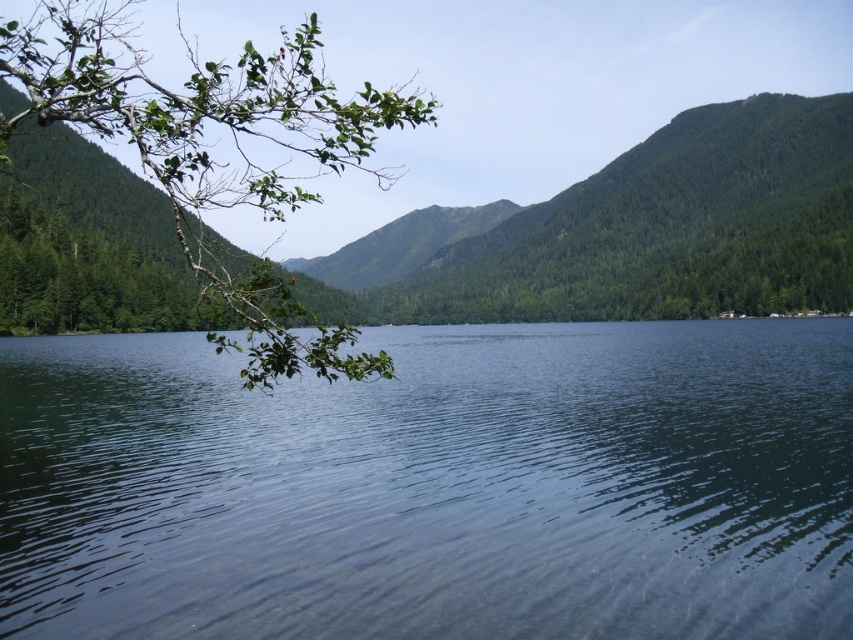
Question: In this image, where is clear water at center located relative to green leafy branch at upper left?

Choices:
 (A) above
 (B) below

Answer: (B)

Question: Which object is closer to the camera taking this photo?

Choices:
 (A) clear water at center
 (B) green leafy branch at upper left

Answer: (B)

Question: Where is clear water at center located in relation to green leafy branch at upper left in the image?

Choices:
 (A) below
 (B) above

Answer: (A)

Question: Can you confirm if clear water at center is positioned to the left of green leafy branch at upper left?

Choices:
 (A) yes
 (B) no

Answer: (B)